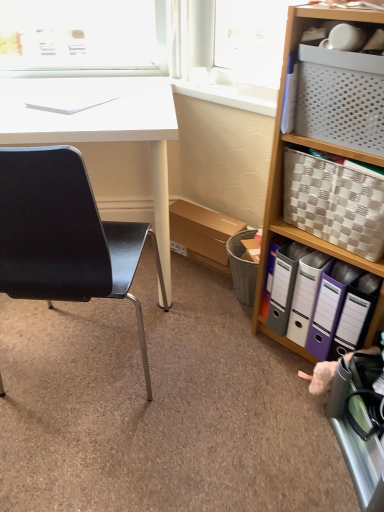
This screenshot has width=384, height=512. In order to click on black matte chair at left in this screenshot , I will do `click(65, 234)`.

The height and width of the screenshot is (512, 384). What do you see at coordinates (100, 128) in the screenshot?
I see `white glossy desk at left` at bounding box center [100, 128].

What are the coordinates of `white woven basket at right` in the screenshot? It's located at (308, 146).

Considering the relative positions of black matte chair at left and checkered fabric picnic basket at right in the image provided, is black matte chair at left to the right of checkered fabric picnic basket at right from the viewer's perspective?

Incorrect, black matte chair at left is not on the right side of checkered fabric picnic basket at right.

From a real-world perspective, is black matte chair at left under checkered fabric picnic basket at right?

Correct, in the physical world, black matte chair at left is lower than checkered fabric picnic basket at right.

You are a GUI agent. You are given a task and a screenshot of the screen. Output one action in this format:
    pyautogui.click(x=<x>, y=<y>)
    Task: Click on the picnic basket behind the black matte chair at left
    The height and width of the screenshot is (512, 384).
    Given the screenshot: What is the action you would take?
    pyautogui.click(x=334, y=203)

From a real-world perspective, is white woven basket at right beneath checkered fabric picnic basket at right?

Correct, in the physical world, white woven basket at right is lower than checkered fabric picnic basket at right.

Would you say white woven basket at right is a long distance from checkered fabric picnic basket at right?

They are positioned close to each other.

Can you confirm if white woven basket at right is thinner than checkered fabric picnic basket at right?

Incorrect, the width of white woven basket at right is not less than that of checkered fabric picnic basket at right.

Which of these two, white glossy desk at left or black matte chair at left, is thinner?

Thinner between the two is black matte chair at left.

From the image's perspective, does white glossy desk at left appear higher than black matte chair at left?

Yes, from the image's perspective, white glossy desk at left is above black matte chair at left.

From a real-world perspective, is white glossy desk at left over black matte chair at left?

No.

In the image, is white glossy desk at left on the left side or the right side of black matte chair at left?

Based on their positions, white glossy desk at left is located to the left of black matte chair at left.

Relative to white glossy desk at left, is black matte chair at left in front or behind?

Visually, black matte chair at left is located in front of white glossy desk at left.

From their relative heights in the image, would you say black matte chair at left is taller or shorter than white glossy desk at left?

In the image, black matte chair at left appears to be taller than white glossy desk at left.

Considering the sizes of objects black matte chair at left and white glossy desk at left in the image provided, who is wider, black matte chair at left or white glossy desk at left?

white glossy desk at left is wider.

Is black matte chair at left spatially inside white glossy desk at left, or outside of it?

black matte chair at left is outside white glossy desk at left.

Locate an element on the screen. This screenshot has height=512, width=384. window sill on the left of checkered fabric picnic basket at right is located at coordinates (223, 96).

Who is shorter, white plastic window sill at upper center or checkered fabric picnic basket at right?

white plastic window sill at upper center.

Can you confirm if white plastic window sill at upper center is positioned to the left of checkered fabric picnic basket at right?

Indeed, white plastic window sill at upper center is positioned on the left side of checkered fabric picnic basket at right.

Can you confirm if checkered fabric picnic basket at right is positioned to the left of black matte chair at left?

In fact, checkered fabric picnic basket at right is to the right of black matte chair at left.

Based on their sizes in the image, would you say checkered fabric picnic basket at right is bigger or smaller than black matte chair at left?

In the image, checkered fabric picnic basket at right appears to be smaller than black matte chair at left.

In the image, is checkered fabric picnic basket at right positioned in front of or behind black matte chair at left?

Visually, checkered fabric picnic basket at right is located behind black matte chair at left.

Does white plastic window sill at upper center have a lesser width compared to black matte chair at left?

Yes, white plastic window sill at upper center is thinner than black matte chair at left.

In the image, is white plastic window sill at upper center on the left side or the right side of black matte chair at left?

In the image, white plastic window sill at upper center appears on the right side of black matte chair at left.

Is white plastic window sill at upper center next to black matte chair at left and touching it?

No, white plastic window sill at upper center is not touching black matte chair at left.

Where is `chair that is below the checkered fabric picnic basket at right (from the image's perspective)`? The image size is (384, 512). chair that is below the checkered fabric picnic basket at right (from the image's perspective) is located at coordinates (65, 234).

There is a white woven basket at right. Identify the location of picnic basket above it (from a real-world perspective). (334, 203).

Looking at the image, which one is located further to checkered fabric picnic basket at right, white glossy desk at left or black matte chair at left?

Based on the image, white glossy desk at left appears to be further to checkered fabric picnic basket at right.

Considering their positions, is black matte chair at left positioned closer to white glossy desk at left than white plastic window sill at upper center?

white plastic window sill at upper center is positioned closer to the anchor white glossy desk at left.

Considering their positions, is black matte chair at left positioned closer to white woven basket at right than white plastic window sill at upper center?

white plastic window sill at upper center.

Considering their positions, is black matte chair at left positioned further to white plastic window sill at upper center than checkered fabric picnic basket at right?

black matte chair at left is further to white plastic window sill at upper center.

When comparing their distances from checkered fabric picnic basket at right, does white woven basket at right or white glossy desk at left seem further?

Among the two, white glossy desk at left is located further to checkered fabric picnic basket at right.

Based on the photo, based on their spatial positions, is white glossy desk at left or white woven basket at right further from checkered fabric picnic basket at right?

white glossy desk at left.

Consider the image. Based on their spatial positions, is white woven basket at right or black matte chair at left closer to checkered fabric picnic basket at right?

white woven basket at right is positioned closer to the anchor checkered fabric picnic basket at right.

Looking at the image, which one is located further to black matte chair at left, white woven basket at right or white plastic window sill at upper center?

The object further to black matte chair at left is white plastic window sill at upper center.

This screenshot has width=384, height=512. Identify the location of bookcase between white glossy desk at left and checkered fabric picnic basket at right in the horizontal direction. (308, 146).

What are the coordinates of `chair between white glossy desk at left and checkered fabric picnic basket at right in the horizontal direction` in the screenshot? It's located at (65, 234).

Image resolution: width=384 pixels, height=512 pixels. Find the location of `window sill between white glossy desk at left and white woven basket at right`. window sill between white glossy desk at left and white woven basket at right is located at coordinates (223, 96).

You are a GUI agent. You are given a task and a screenshot of the screen. Output one action in this format:
    pyautogui.click(x=<x>, y=<y>)
    Task: Click on the window sill between white glossy desk at left and checkered fabric picnic basket at right from left to right
    The width and height of the screenshot is (384, 512).
    Given the screenshot: What is the action you would take?
    pyautogui.click(x=223, y=96)